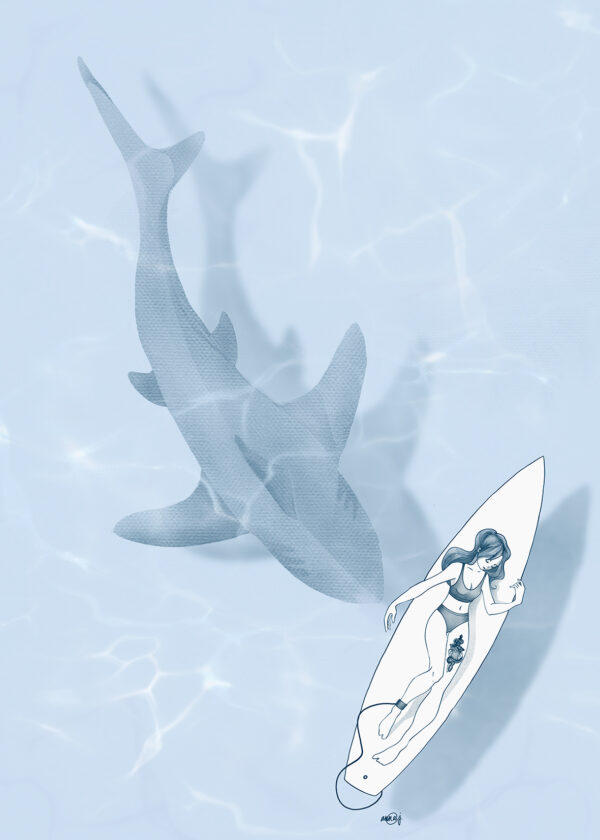
I want to click on cord, so click(359, 757).